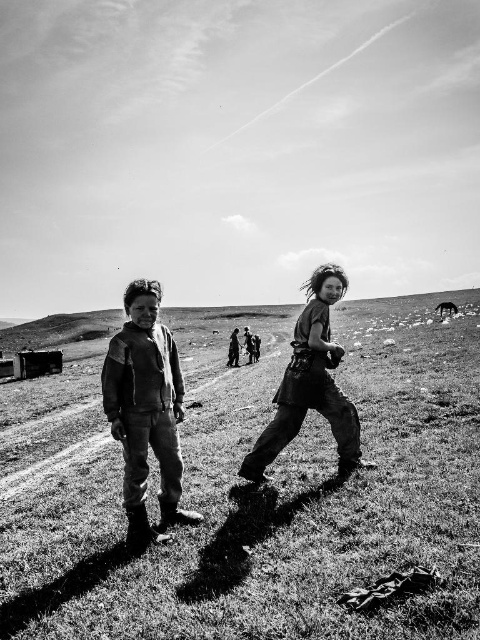
Which of these two, grass at center or rugged leather jacket at center, stands taller?

grass at center

Can you confirm if grass at center is thinner than rugged leather jacket at center?

No, grass at center is not thinner than rugged leather jacket at center.

Who is more forward, (x=98, y=468) or (x=245, y=468)?

Point (x=245, y=468) is in front.

In order to click on grass at center in this screenshot , I will do `click(254, 492)`.

Based on the photo, who is taller, leather jacket at center or rugged leather jacket at center?

Standing taller between the two is leather jacket at center.

Which is more to the right, leather jacket at center or rugged leather jacket at center?

rugged leather jacket at center is more to the right.

Who is more forward, (147,280) or (323,340)?

Positioned in front is point (147,280).

Locate an element on the screen. Image resolution: width=480 pixels, height=640 pixels. leather jacket at center is located at coordinates (145, 410).

Between grass at center and leather jacket at center, which one is positioned lower?

grass at center is below.

Identify the location of grass at center. This screenshot has width=480, height=640. point(254,492).

The width and height of the screenshot is (480, 640). What do you see at coordinates (254, 492) in the screenshot? I see `grass at center` at bounding box center [254, 492].

Identify the location of grass at center. (254, 492).